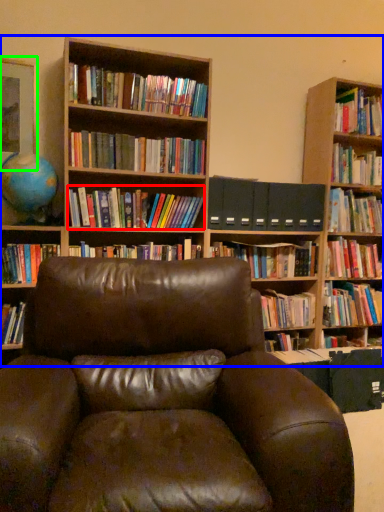
Question: Which object is the farthest from book (highlighted by a red box)? Choose among these: bookcase (highlighted by a blue box) or picture frame (highlighted by a green box).

Choices:
 (A) bookcase
 (B) picture frame

Answer: (B)